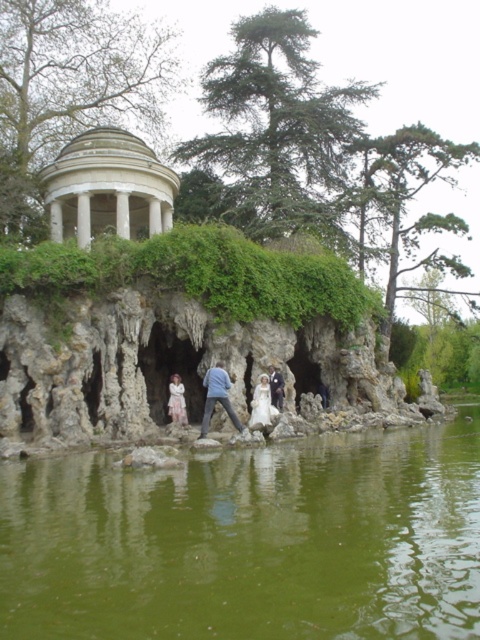
Which is below, blue denim jeans at center or white satin dress at center?

Positioned lower is white satin dress at center.

Can you confirm if blue denim jeans at center is taller than white satin dress at center?

No, blue denim jeans at center is not taller than white satin dress at center.

Which is in front, point (229, 378) or point (264, 412)?

Positioned in front is point (264, 412).

Where is `blue denim jeans at center`? The width and height of the screenshot is (480, 640). blue denim jeans at center is located at coordinates (216, 396).

Consider the image. Can you confirm if white marble gazebo at upper center is positioned to the left of white cotton dress at center?

Yes, white marble gazebo at upper center is to the left of white cotton dress at center.

Which of these two, white marble gazebo at upper center or white cotton dress at center, stands shorter?

white cotton dress at center

Find the location of `white marble gazebo at upper center`. white marble gazebo at upper center is located at coordinates (108, 188).

Is point (183, 419) more distant than point (274, 371)?

That is False.

Identify the location of white lace dress at center. The width and height of the screenshot is (480, 640). (177, 401).

Where is `white lace dress at center`? The width and height of the screenshot is (480, 640). white lace dress at center is located at coordinates (177, 401).